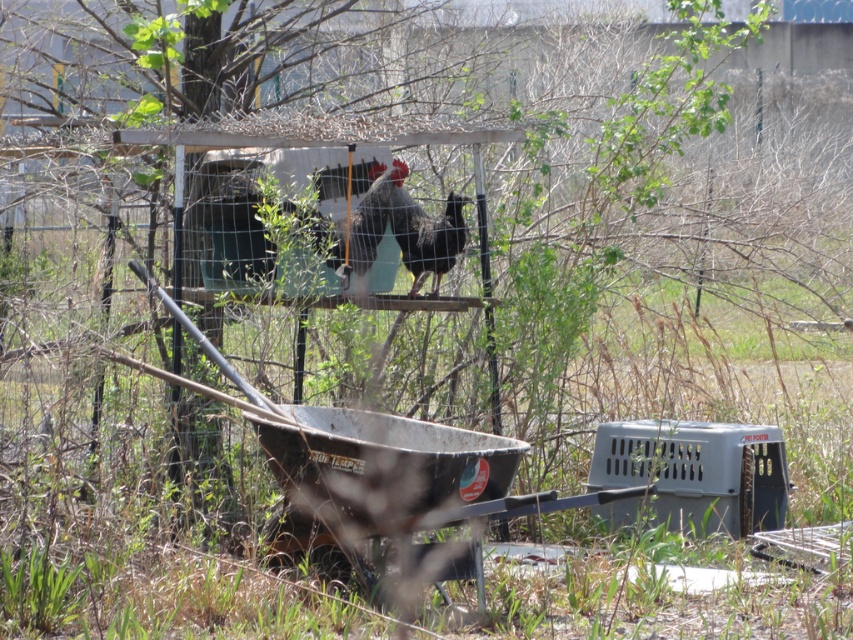
You are standing in the outdoor scene described. There is a point labeled at coordinates (x=425, y=232). What object is located at this point?

The point at coordinates (x=425, y=232) corresponds to the black glossy rooster at center.

You are a farmer checking on your chickens. You see a black glossy rooster at center and a silvery metallic rooster at center. Which rooster is closer to you?

The black glossy rooster at center is closer to you because the silvery metallic rooster at center is behind it.